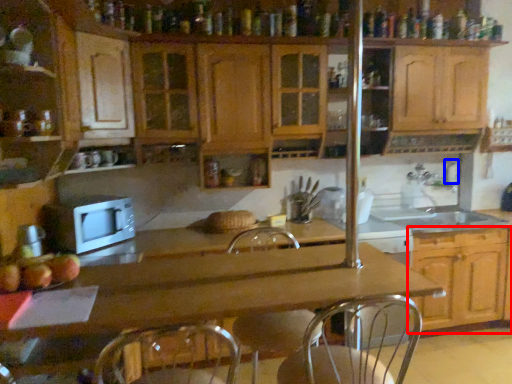
Question: Which object is further to the camera taking this photo, cabinetry (highlighted by a red box) or faucet (highlighted by a blue box)?

Choices:
 (A) cabinetry
 (B) faucet

Answer: (B)